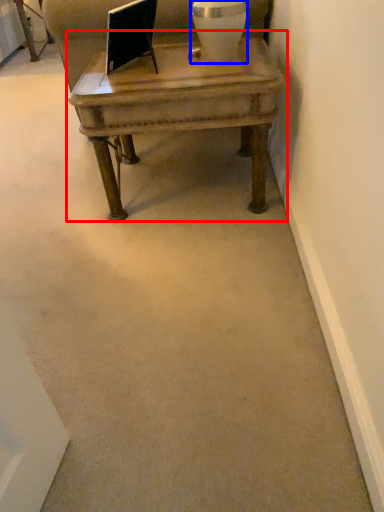
Question: Which object is further to the camera taking this photo, coffee table (highlighted by a red box) or vase (highlighted by a blue box)?

Choices:
 (A) coffee table
 (B) vase

Answer: (B)